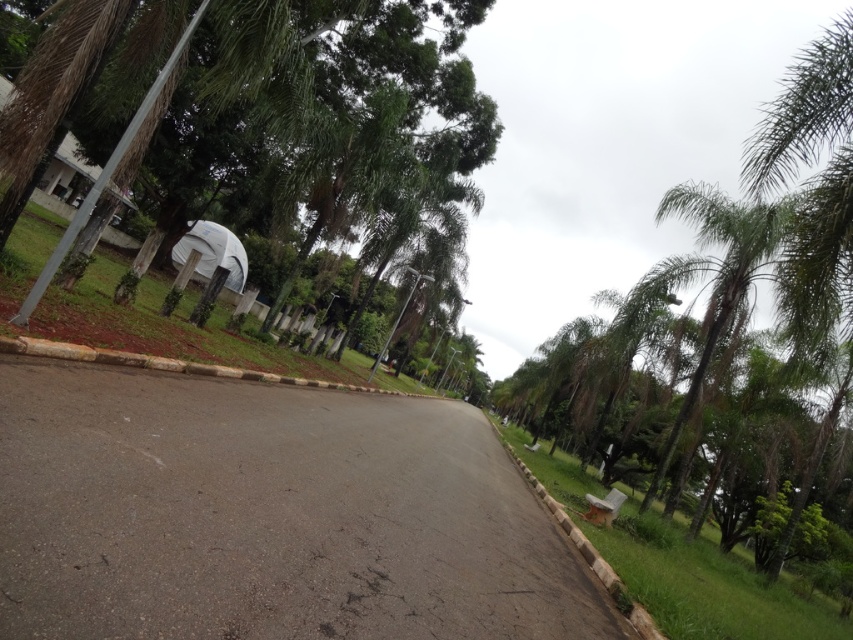
You are a hiker standing at the center of the road. You see a point marked at coordinates (325, 99). What object is located at that point?

The point at coordinates (325, 99) indicates a green leafy tree at upper left.

You are a hiker standing on the road and want to take a photo of both the green leafy tree at upper left and the green leafy palm tree at right. Which tree should you focus on first if you want to capture both in the same frame without moving your camera?

The green leafy palm tree at right is lower than the green leafy tree at upper left, so you should focus on the green leafy palm tree at right first to ensure both are in the frame.